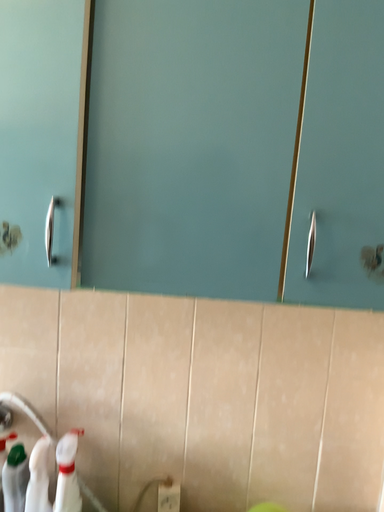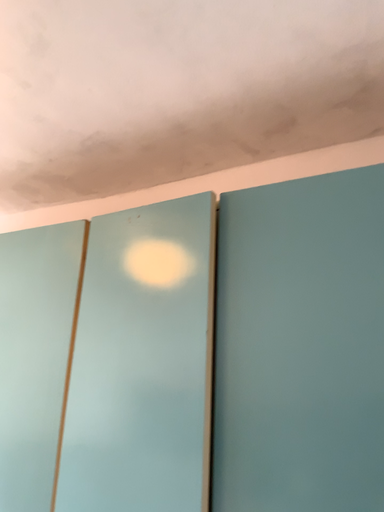
Question: Which way did the camera rotate in the video?

Choices:
 (A) rotated downward
 (B) rotated upward

Answer: (B)